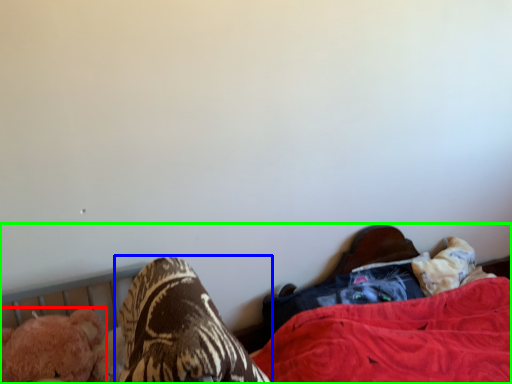
Question: Estimate the real-world distances between objects in this image. Which object is farther from animal (highlighted by a red box), footwear (highlighted by a blue box) or bed (highlighted by a green box)?

Choices:
 (A) footwear
 (B) bed

Answer: (B)